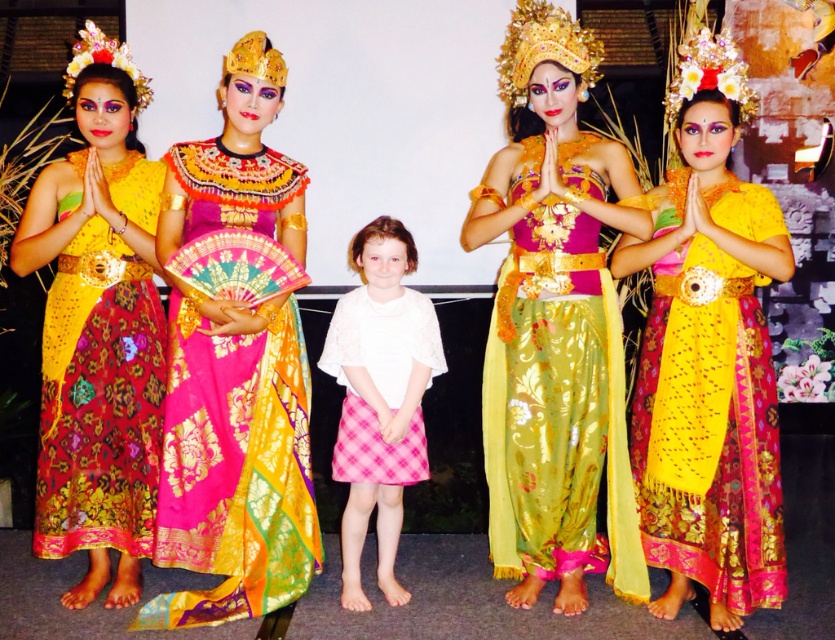
You are a photographer adjusting your camera settings to focus on two specific points in the scene. The first point is at coordinate point[755,353] and the second is at point[408,456]. Which point should you focus on first if you want to ensure the closest object is in sharp focus?

Point[755,353] is closer to the camera than point[408,456], so you should focus on point[755,353] first to ensure the closest object is in sharp focus.

You are organizing a photo shoot and need to arrange the shiny silk dress at center and the matte gold fabric dress at left in a way that maximizes visual impact. Considering their spatial properties, which dress should be placed in a more prominent position and why?

The matte gold fabric dress at left should be placed in a more prominent position because it occupies more space than the shiny silk dress at center, making it visually dominant.

You are an event photographer at the ceremony. You need to capture a photo of the two people wearing the matte yellow fabric dress at center and the pink plaid skirt at center. Which one is positioned to the right side?

The matte yellow fabric dress at center is to the right of the pink plaid skirt at center.